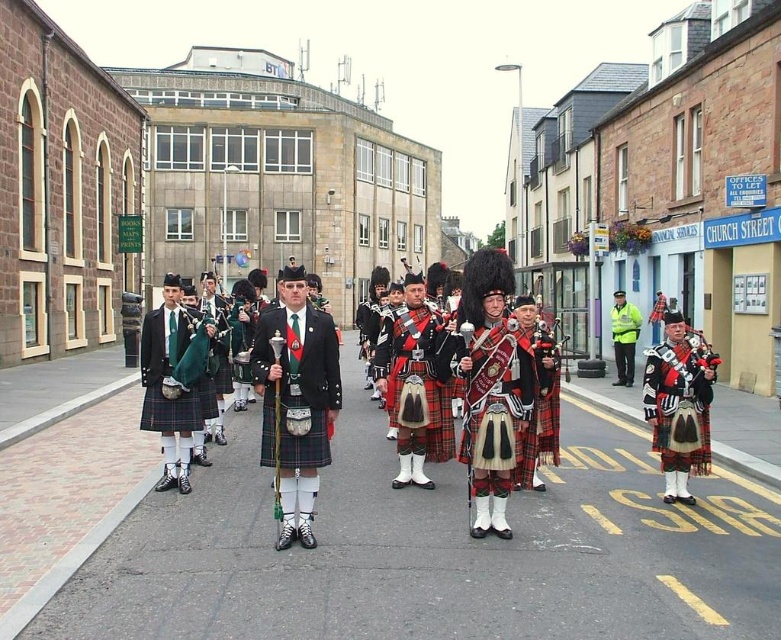
Which is in front, point (423, 433) or point (633, 349)?

Point (423, 433)

Does red plaid kilt at center appear under yellow reflective jacket at center?

No.

Does point (319, 340) come closer to viewer compared to point (623, 321)?

That is True.

What are the coordinates of `red plaid kilt at center` in the screenshot? It's located at (487, 381).

Is matte black kilt at center below red tartan kilt at center?

Actually, matte black kilt at center is above red tartan kilt at center.

Can you confirm if matte black kilt at center is positioned to the left of red tartan kilt at center?

Indeed, matte black kilt at center is positioned on the left side of red tartan kilt at center.

Is point (270, 368) less distant than point (683, 381)?

Yes, point (270, 368) is in front of point (683, 381).

Locate an element on the screen. Image resolution: width=781 pixels, height=640 pixels. matte black kilt at center is located at coordinates (294, 401).

Who is shorter, matte black kilt at center or yellow reflective jacket at center?

With less height is yellow reflective jacket at center.

Does matte black kilt at center appear on the right side of yellow reflective jacket at center?

In fact, matte black kilt at center is to the left of yellow reflective jacket at center.

Does point (282, 360) come in front of point (612, 330)?

That is True.

Locate an element on the screen. matte black kilt at center is located at coordinates (294, 401).